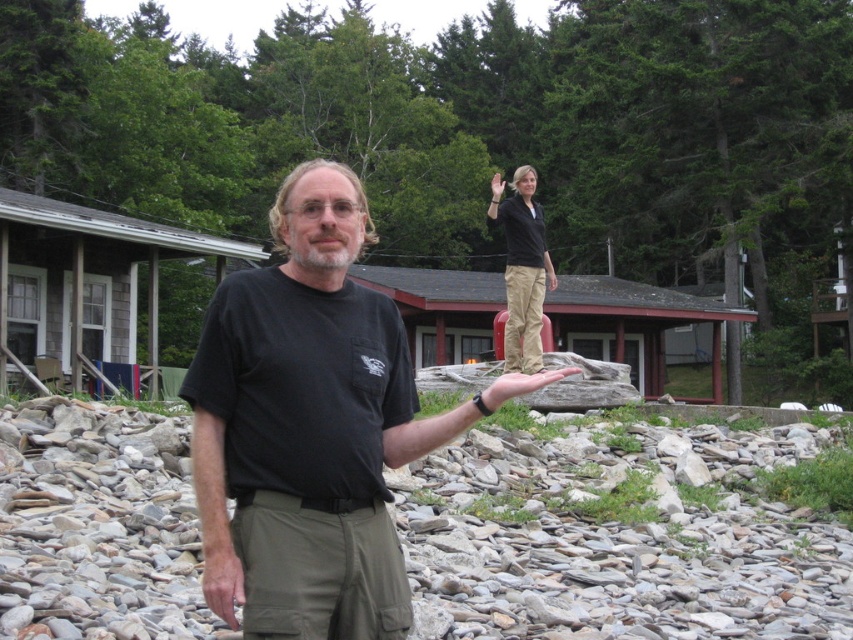
Image resolution: width=853 pixels, height=640 pixels. What do you see at coordinates (610, 557) in the screenshot? I see `gray smooth rocks at lower center` at bounding box center [610, 557].

Measure the distance between gray smooth rocks at lower center and camera.

gray smooth rocks at lower center is 5.98 meters from camera.

The width and height of the screenshot is (853, 640). Identify the location of gray smooth rocks at lower center. (610, 557).

Looking at this image, which of these two, black matte t-shirt at center or khaki pants at center, stands shorter?

black matte t-shirt at center

Which is more to the left, black matte t-shirt at center or khaki pants at center?

From the viewer's perspective, black matte t-shirt at center appears more on the left side.

Is point (305, 580) positioned after point (506, 211)?

No, it is not.

Image resolution: width=853 pixels, height=640 pixels. Find the location of `black matte t-shirt at center`. black matte t-shirt at center is located at coordinates (311, 428).

Between point (463, 618) and point (519, 250), which one is positioned in front?

Point (463, 618)

The height and width of the screenshot is (640, 853). I want to click on gray smooth rocks at lower center, so click(x=610, y=557).

Where is `gray smooth rocks at lower center`? This screenshot has width=853, height=640. gray smooth rocks at lower center is located at coordinates (610, 557).

The image size is (853, 640). In order to click on gray smooth rocks at lower center in this screenshot , I will do click(610, 557).